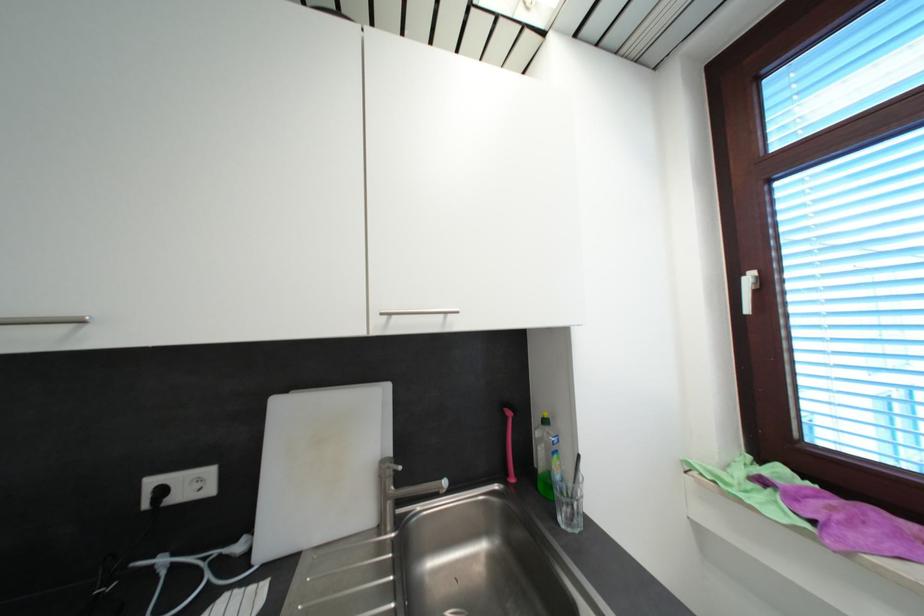
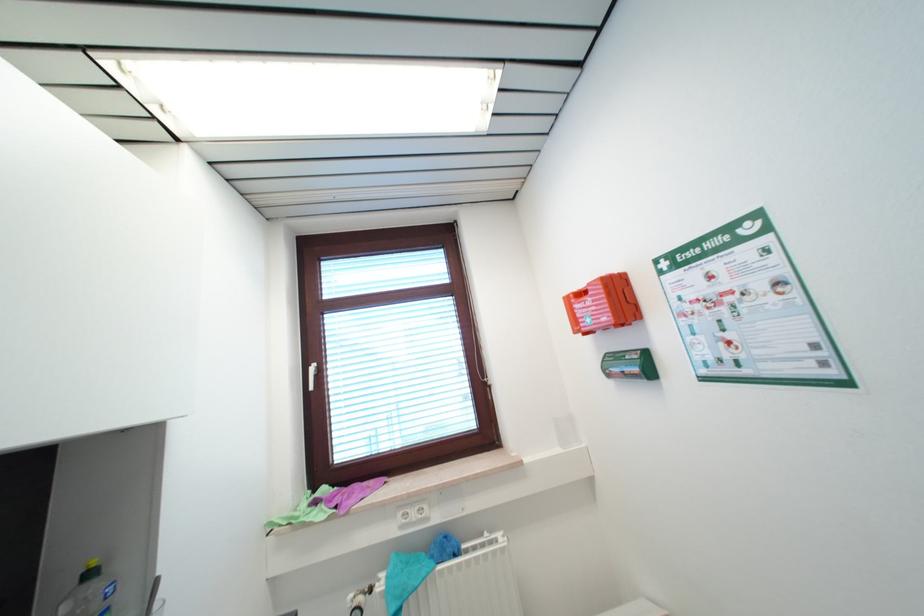
Locate, in the second image, the point that corresponds to point (693, 466) in the first image.

(274, 525)